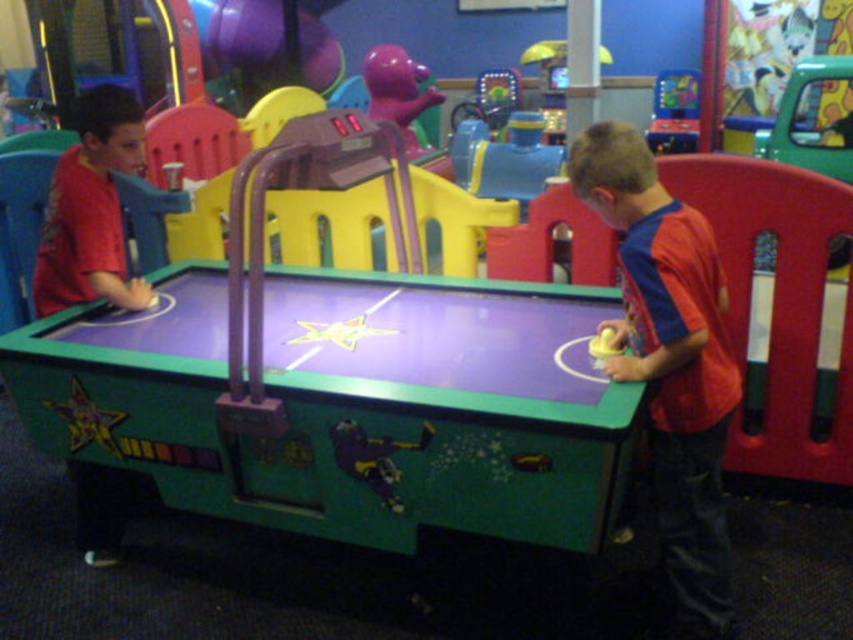
You are a parent trying to choose between two items for your child. You see the matte red shirt at right and the purple matte bear at upper center. Which item is smaller in size?

The matte red shirt at right is smaller in size compared to the purple matte bear at upper center.

You are a child who wants to reach both the purple matte bear at upper center and the metallic blue arcade machine at upper right. Which object do you need to stretch your arms higher to reach?

The purple matte bear at upper center needs to be reached by stretching your arms higher because it has a larger size compared to the metallic blue arcade machine at upper right.

You are a photographer setting up for a photo shoot in the play area. You need to place a small prop exactly halfway between point (384, 45) and point (665, 148). Will the prop be closer to the camera than both points?

The prop placed halfway between point (384, 45) and point (665, 148) will be closer to the camera than point (665, 148) but farther than point (384, 45). Since the question asks if it is closer than both, the answer is no.